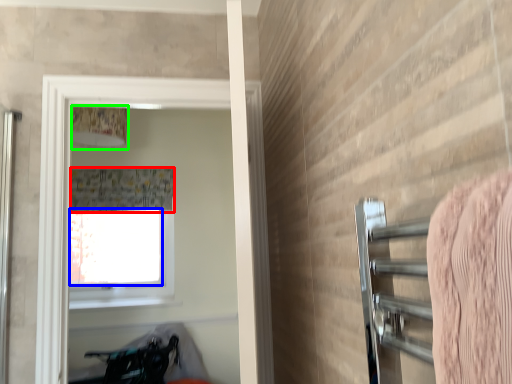
Question: Which object is the closest to the shower curtain (highlighted by a red box)? Choose among these: window screen (highlighted by a blue box) or lamp (highlighted by a green box).

Choices:
 (A) window screen
 (B) lamp

Answer: (A)